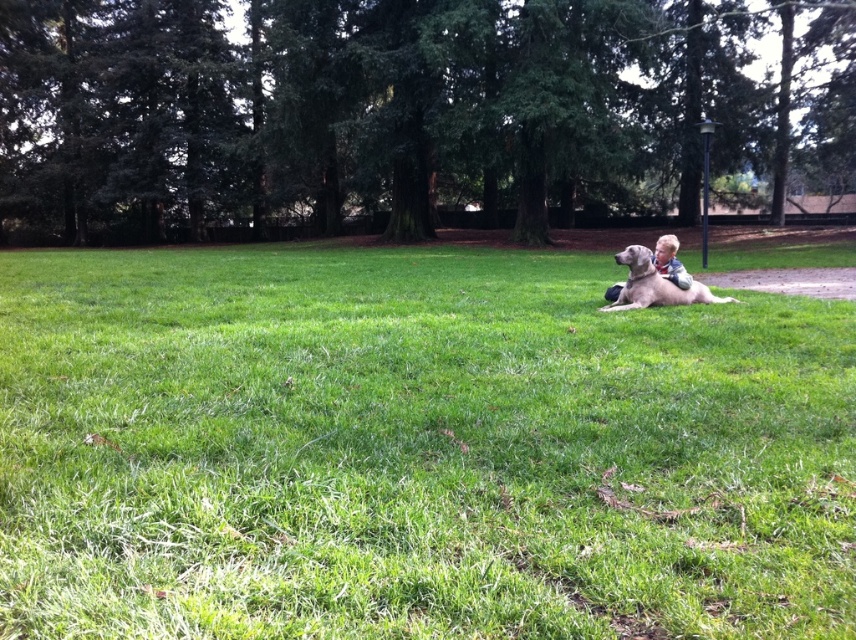
Question: Which object is closer to the camera taking this photo?

Choices:
 (A) green grassy field at center
 (B) light brown fur at center

Answer: (A)

Question: Which object appears farthest from the camera in this image?

Choices:
 (A) light brown fur at center
 (B) green grassy field at center

Answer: (A)

Question: Is green grassy field at center below light brown fur at center?

Choices:
 (A) no
 (B) yes

Answer: (B)

Question: Which of the following is the farthest from the observer?

Choices:
 (A) (776, 392)
 (B) (640, 268)

Answer: (B)

Question: Is green grassy field at center to the right of light brown fur at center from the viewer's perspective?

Choices:
 (A) yes
 (B) no

Answer: (B)

Question: Can you confirm if green grassy field at center is positioned to the right of light brown fur at center?

Choices:
 (A) no
 (B) yes

Answer: (A)